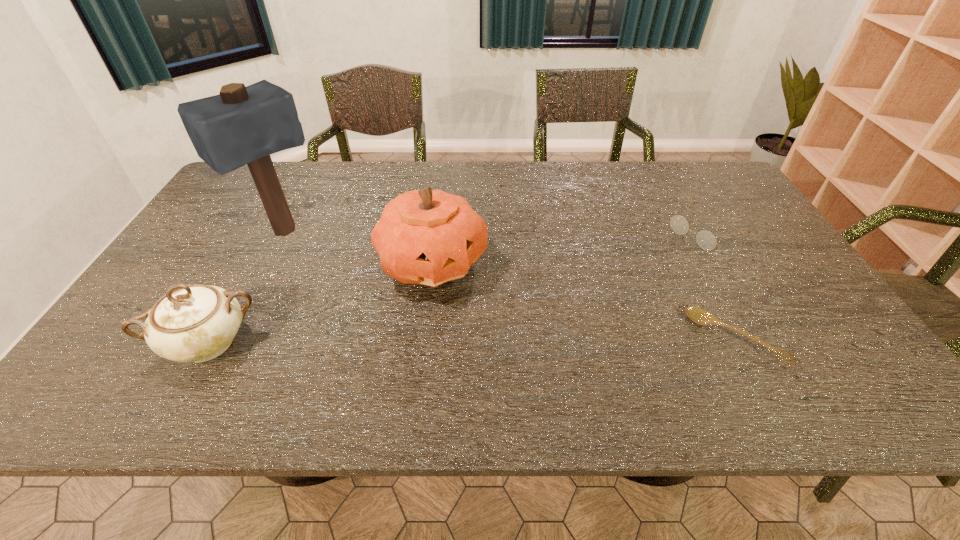
Locate an element on the screen. chinaware is located at coordinates (195, 323).

The height and width of the screenshot is (540, 960). In order to click on ladle in this screenshot , I will do `click(698, 315)`.

This screenshot has width=960, height=540. In order to click on spectacles in this screenshot , I will do [705, 239].

Where is `mallet`? mallet is located at coordinates (242, 125).

Where is `the third object from left to right`? This screenshot has height=540, width=960. the third object from left to right is located at coordinates (430, 237).

Locate an element on the screen. pumpkin is located at coordinates (430, 237).

Find the location of a particular element. The height and width of the screenshot is (540, 960). vacant space located on the right of the third shortest object is located at coordinates (299, 344).

Where is `blank space located 0.060m on the back of the shortest object`? The height and width of the screenshot is (540, 960). blank space located 0.060m on the back of the shortest object is located at coordinates pos(711,293).

I want to click on free space located on the temples of the fourth tallest object, so click(x=660, y=259).

This screenshot has width=960, height=540. Find the location of `vacant space located on the temples of the fourth tallest object`. vacant space located on the temples of the fourth tallest object is located at coordinates (614, 287).